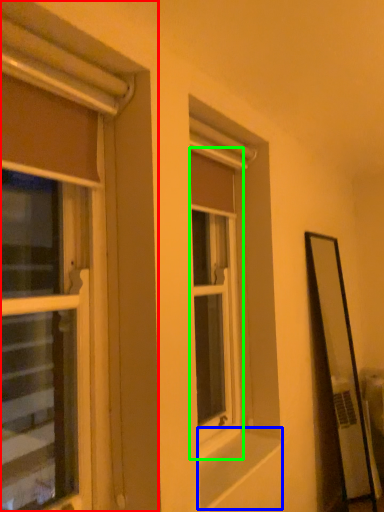
Question: Estimate the real-world distances between objects in this image. Which object is farther from window (highlighted by a red box), window sill (highlighted by a blue box) or window (highlighted by a green box)?

Choices:
 (A) window sill
 (B) window

Answer: (B)